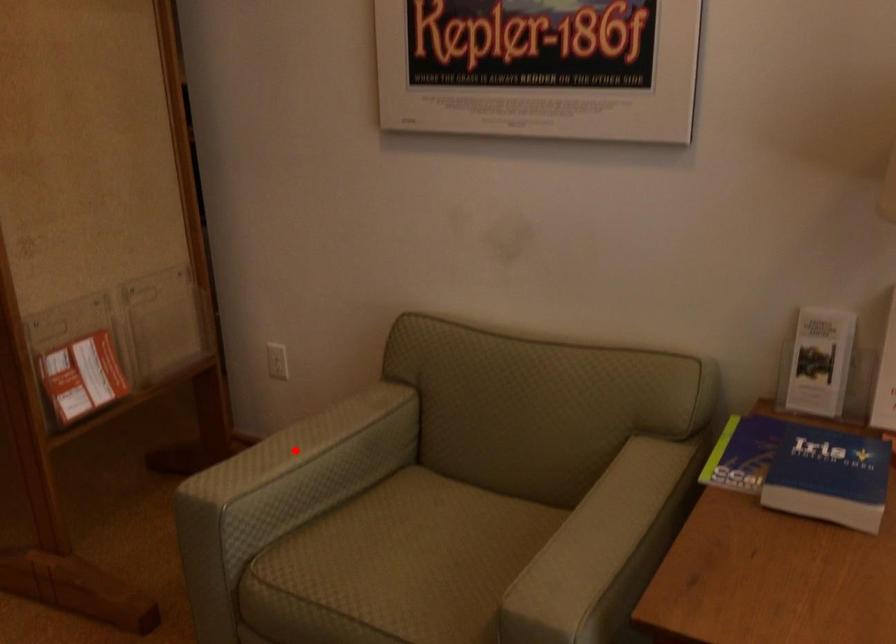
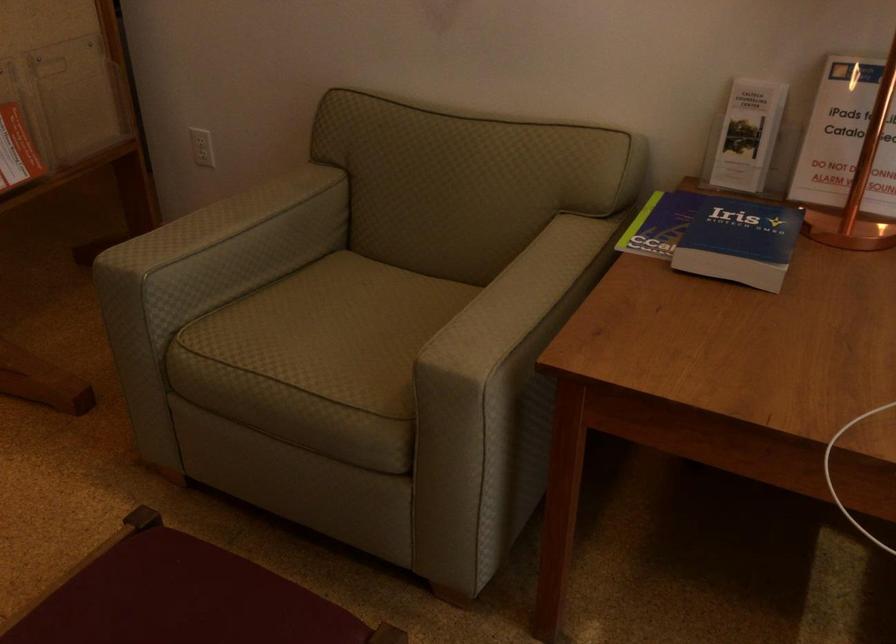
The point at the highlighted location is marked in the first image. Where is the corresponding point in the second image?

(219, 222)